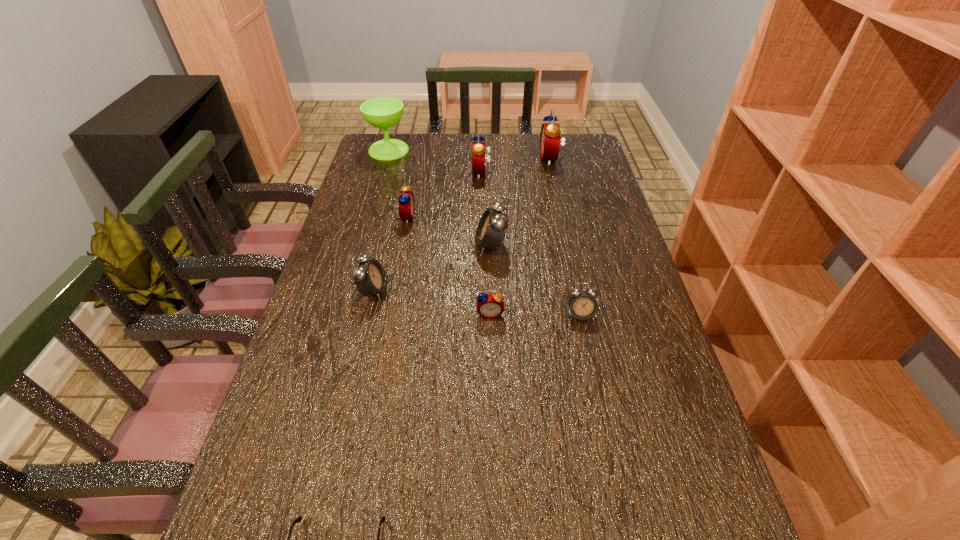
This screenshot has height=540, width=960. In order to click on the rightmost red alarm clock in this screenshot , I will do `click(550, 133)`.

Locate an element on the screen. Image resolution: width=960 pixels, height=540 pixels. the biggest red alarm clock is located at coordinates (550, 133).

Find the location of a particular element. green wineglass is located at coordinates (384, 112).

Where is `the third smallest red alarm clock`? the third smallest red alarm clock is located at coordinates (478, 148).

Locate an element on the screen. The width and height of the screenshot is (960, 540). the fifth farthest object is located at coordinates (492, 227).

Locate an element on the screen. The image size is (960, 540). the fourth farthest alarm clock is located at coordinates [492, 227].

This screenshot has width=960, height=540. I want to click on the leftmost red alarm clock, so click(x=406, y=204).

You are a GUI agent. You are given a task and a screenshot of the screen. Output one action in this format:
    pyautogui.click(x=<x>, y=<y>)
    Task: Click on the second nearest red alarm clock
    This screenshot has height=540, width=960.
    Given the screenshot: What is the action you would take?
    pyautogui.click(x=406, y=204)

Where is `the third nearest alarm clock`? the third nearest alarm clock is located at coordinates (370, 279).

I want to click on the leftmost white alarm clock, so click(x=370, y=279).